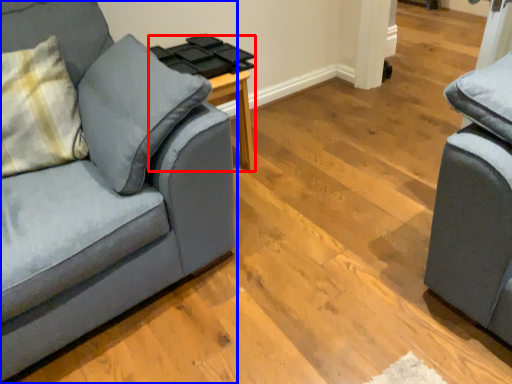
Question: Among these objects, which one is farthest to the camera, side table (highlighted by a red box) or studio couch (highlighted by a blue box)?

Choices:
 (A) side table
 (B) studio couch

Answer: (A)